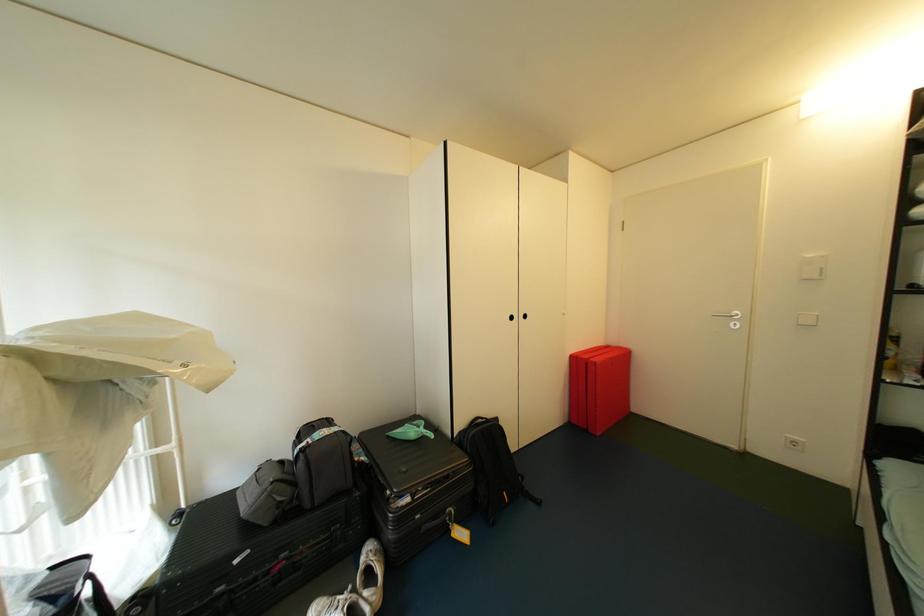
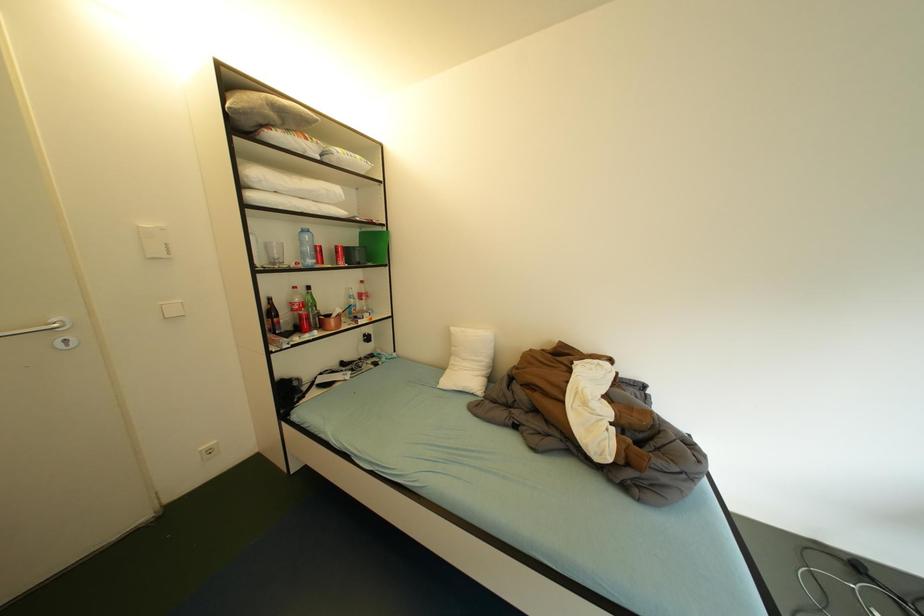
Question: The camera is either moving clockwise (left) or counter-clockwise (right) around the object. The first image is from the beginning of the video and the second image is from the end. Is the camera moving left or right when shooting the video?

Choices:
 (A) Left
 (B) Right

Answer: (A)